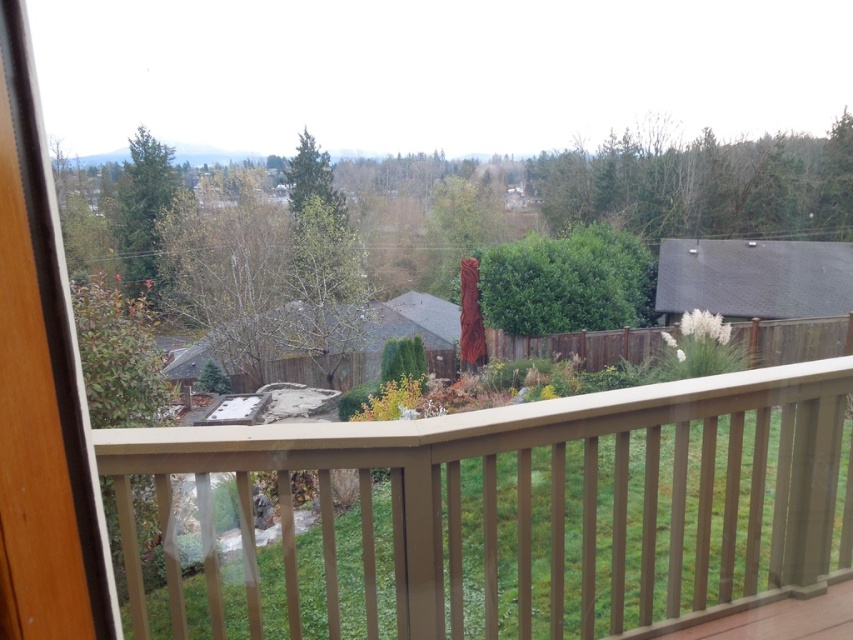
You are standing on the balcony and want to know which tree has a wider spread between the green leafy tree at upper right and the green matte tree at upper left. Which one is wider?

The green leafy tree at upper right has a wider spread than the green matte tree at upper left.

You are standing on the balcony and want to locate two specific points in the garden. The first point is at coordinates point (x=627, y=564) and the second is at point (x=19, y=205). Which of these points is closer to you, the observer?

Point (x=19, y=205) is closer to you because it is in front of point (x=627, y=564), which is behind it.